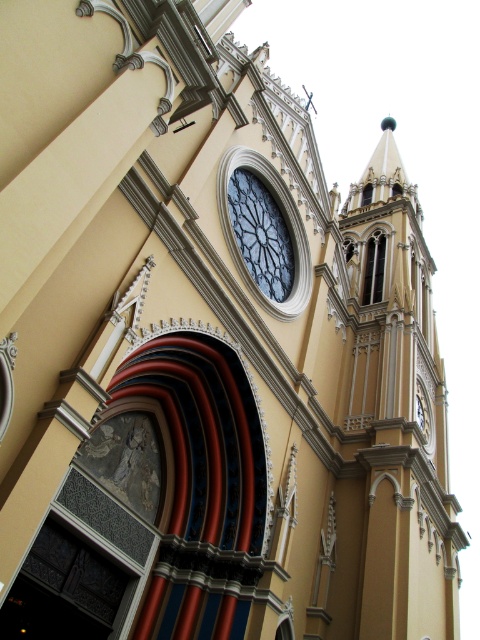
Question: Does gold polished stone tower at upper right appear under dark glass clock at center?

Choices:
 (A) yes
 (B) no

Answer: (B)

Question: In this image, where is gold polished stone tower at upper right located relative to dark glass clock at center?

Choices:
 (A) right
 (B) left

Answer: (A)

Question: Can you confirm if gold polished stone tower at upper right is positioned to the left of dark glass clock at center?

Choices:
 (A) yes
 (B) no

Answer: (B)